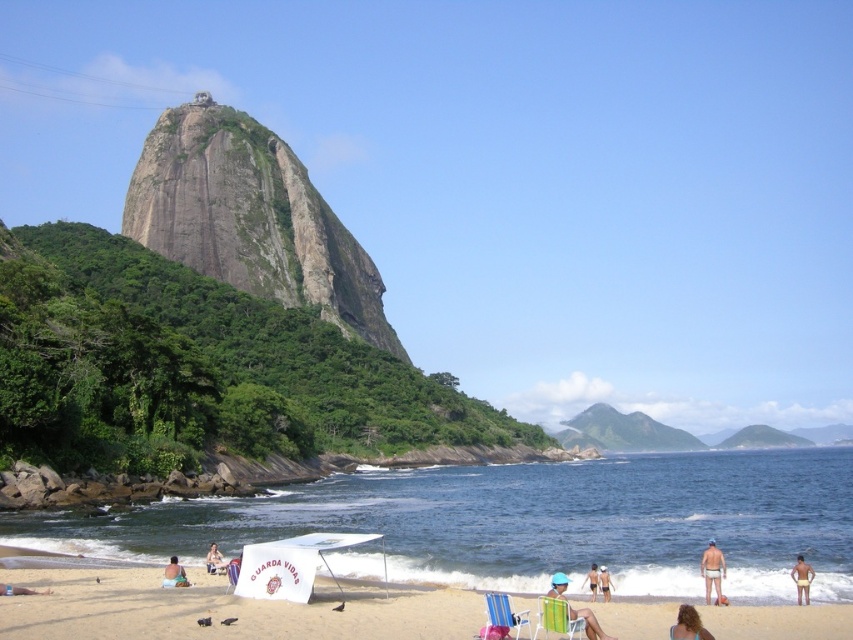
Question: Which point is closer to the camera?

Choices:
 (A) white plastic beach chair at center
 (B) blue striped beach chair at lower center
 (C) blue water at beach lower

Answer: (B)

Question: Is blue water at beach lower positioned before tan skin person at center?

Choices:
 (A) no
 (B) yes

Answer: (B)

Question: Does tan skin person at center have a smaller size compared to smooth sand at lower left?

Choices:
 (A) yes
 (B) no

Answer: (B)

Question: Among these points, which one is farthest from the camera?

Choices:
 (A) (149, 582)
 (B) (598, 573)

Answer: (A)

Question: Which of the following is the closest to the observer?

Choices:
 (A) (497, 593)
 (B) (585, 577)
 (C) (810, 580)
 (D) (550, 608)

Answer: (D)

Question: Can you confirm if beige sandy beach at lower center is smaller than green fabric beach chair at lower center?

Choices:
 (A) yes
 (B) no

Answer: (B)